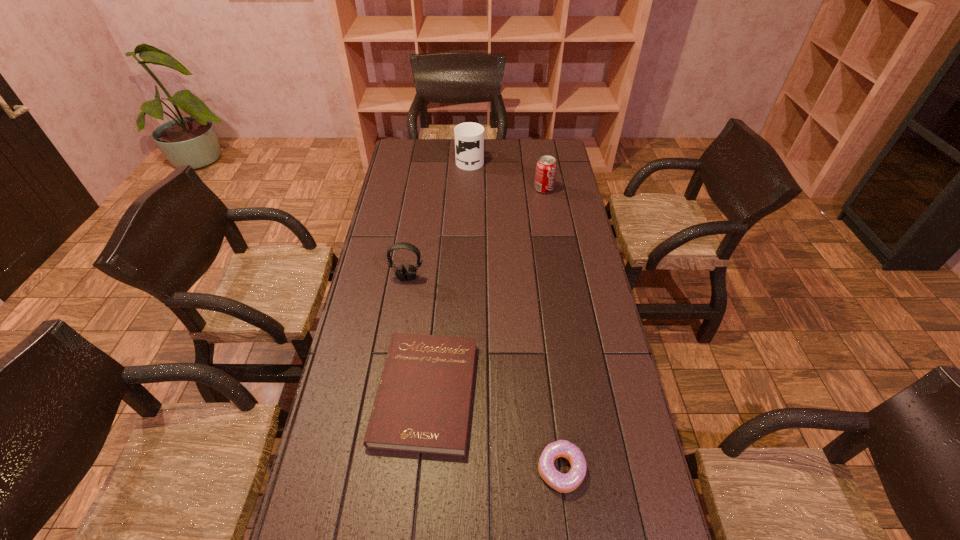
You are a GUI agent. You are given a task and a screenshot of the screen. Output one action in this format:
    pyautogui.click(x=<x>, y=<y>)
    Task: Click on the unoccupied position between the fourth nearest object and the shortest object
    
    Given the screenshot: What is the action you would take?
    pyautogui.click(x=485, y=291)

Identify the location of vacant region between the doughnut and the third farthest object. (484, 374).

At what (x,y) coordinates should I click in order to perform the action: click on vacant area between the shortest object and the mug. Please return your answer as a coordinate pair (x, y). This screenshot has height=540, width=960. Looking at the image, I should click on (447, 276).

What are the coordinates of `free space between the fourth tallest object and the mug` in the screenshot? It's located at (516, 315).

Where is `object that ranks as the second closest to the third farthest object`? This screenshot has height=540, width=960. object that ranks as the second closest to the third farthest object is located at coordinates (546, 167).

Identify which object is the second closest to the farthest object. Please provide its 2D coordinates. Your answer should be formatted as a tuple, i.e. [(x, y)], where the tuple contains the x and y coordinates of a point satisfying the conditions above.

[(401, 273)]

Where is `vacant space that satisfies the following two spatial constraints: 1. on the front-facing side of the headset; 2. on the left side of the shortest object`? vacant space that satisfies the following two spatial constraints: 1. on the front-facing side of the headset; 2. on the left side of the shortest object is located at coordinates (389, 393).

Where is `free spot that satisfies the following two spatial constraints: 1. on the front-facing side of the headset; 2. on the left side of the doughnut`? Image resolution: width=960 pixels, height=540 pixels. free spot that satisfies the following two spatial constraints: 1. on the front-facing side of the headset; 2. on the left side of the doughnut is located at coordinates (376, 470).